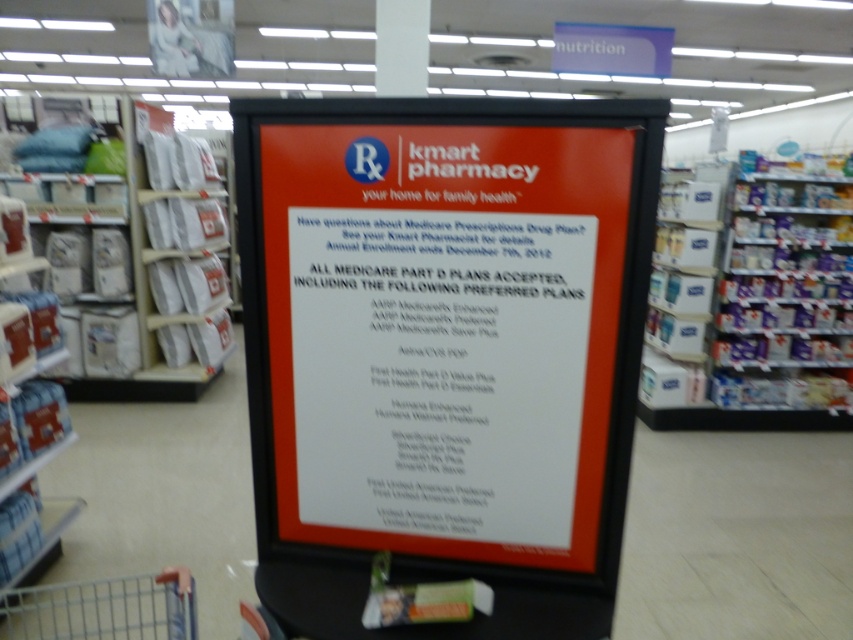
Can you confirm if matte plastic sign at center is smaller than metallic silver shopping cart at lower left?

No, matte plastic sign at center is not smaller than metallic silver shopping cart at lower left.

Locate an element on the screen. Image resolution: width=853 pixels, height=640 pixels. matte plastic sign at center is located at coordinates (445, 326).

Which is in front, point (335, 337) or point (24, 620)?

Positioned in front is point (335, 337).

Identify the location of matte plastic sign at center. (445, 326).